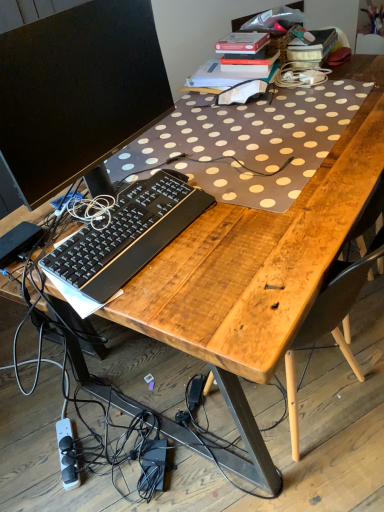
Question: Considering the relative positions of white plastic power strip at lower left and black matte computer monitor at upper left in the image provided, is white plastic power strip at lower left to the left of black matte computer monitor at upper left from the viewer's perspective?

Choices:
 (A) no
 (B) yes

Answer: (B)

Question: Is the position of white plastic power strip at lower left more distant than that of black matte computer monitor at upper left?

Choices:
 (A) yes
 (B) no

Answer: (A)

Question: From the image's perspective, would you say white plastic power strip at lower left is positioned over black matte computer monitor at upper left?

Choices:
 (A) yes
 (B) no

Answer: (B)

Question: Does white plastic power strip at lower left have a greater height compared to black matte computer monitor at upper left?

Choices:
 (A) yes
 (B) no

Answer: (B)

Question: From a real-world perspective, does white plastic power strip at lower left stand above black matte computer monitor at upper left?

Choices:
 (A) yes
 (B) no

Answer: (B)

Question: Is white plastic power strip at lower left facing towards black matte computer monitor at upper left?

Choices:
 (A) no
 (B) yes

Answer: (A)

Question: Is black plastic keyboard at center outside white plastic power strip at lower left?

Choices:
 (A) yes
 (B) no

Answer: (A)

Question: Can you confirm if black plastic keyboard at center is smaller than white plastic power strip at lower left?

Choices:
 (A) yes
 (B) no

Answer: (B)

Question: Is black plastic keyboard at center wider than white plastic power strip at lower left?

Choices:
 (A) yes
 (B) no

Answer: (B)

Question: From a real-world perspective, is black plastic keyboard at center positioned under white plastic power strip at lower left based on gravity?

Choices:
 (A) no
 (B) yes

Answer: (A)

Question: Is black plastic keyboard at center facing away from white plastic power strip at lower left?

Choices:
 (A) no
 (B) yes

Answer: (A)

Question: Could you tell me if black plastic keyboard at center is turned towards white plastic power strip at lower left?

Choices:
 (A) yes
 (B) no

Answer: (B)

Question: Is black plastic keyboard at center touching black matte computer monitor at upper left?

Choices:
 (A) no
 (B) yes

Answer: (A)